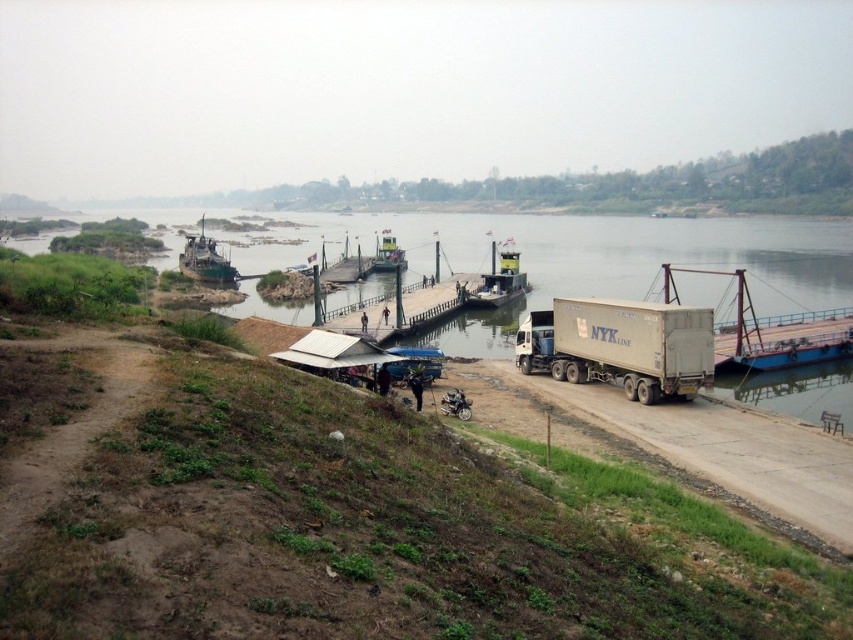
Question: Which object appears farthest from the camera in this image?

Choices:
 (A) wooden dock at center
 (B) wooden planks boat at left
 (C) blue metallic river at center

Answer: (B)

Question: Among these points, which one is nearest to the camera?

Choices:
 (A) coord(212,273)
 (B) coord(485,292)
 (C) coord(103,348)
 (D) coord(779,272)

Answer: (C)

Question: Does blue metallic river at center appear on the right side of white matte trailer truck at center?

Choices:
 (A) yes
 (B) no

Answer: (B)

Question: Where is wooden planks boat at left located in relation to green plastic boat at center in the image?

Choices:
 (A) below
 (B) above

Answer: (B)

Question: Can you confirm if blue metallic river at center is bigger than brown dirt track at lower left?

Choices:
 (A) no
 (B) yes

Answer: (B)

Question: Which point appears farthest from the camera in this image?

Choices:
 (A) (349, 326)
 (B) (71, 433)
 (C) (511, 244)

Answer: (C)